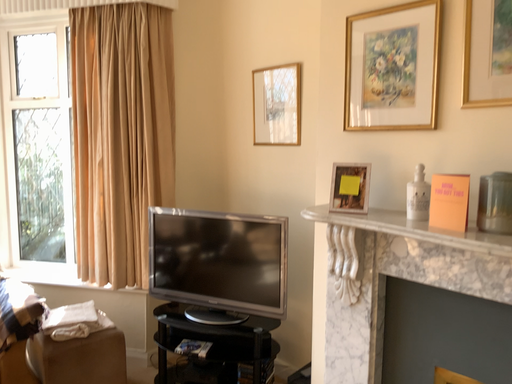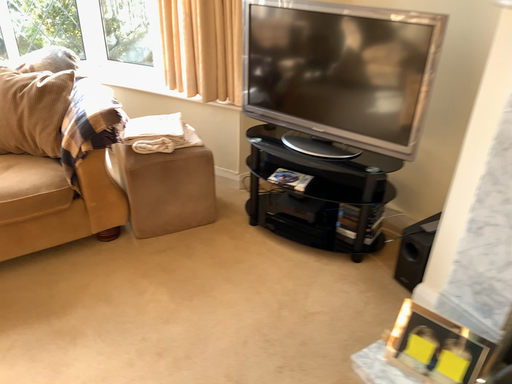
Question: Which way did the camera rotate in the video?

Choices:
 (A) rotated downward
 (B) rotated upward

Answer: (A)